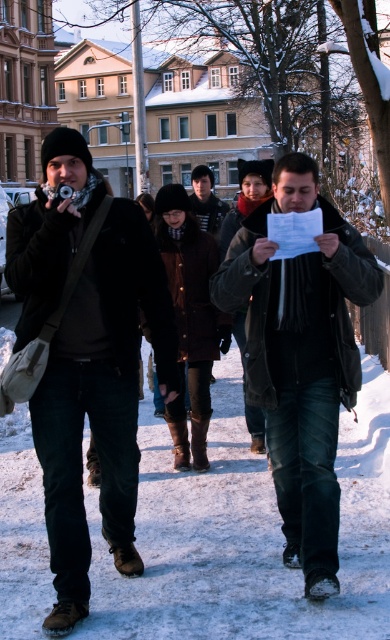
Between point (141, 554) and point (90, 371), which one is positioned in front?

Positioned in front is point (90, 371).

Which is above, white snow at lower center or matte black jacket at left?

matte black jacket at left is higher up.

Is point (195, 589) in front of point (127, 531)?

Yes, point (195, 589) is in front of point (127, 531).

You are a GUI agent. You are given a task and a screenshot of the screen. Output one action in this format:
    pyautogui.click(x=<x>, y=<y>)
    Task: Click on the white snow at lower center
    
    Given the screenshot: What is the action you would take?
    pyautogui.click(x=244, y=534)

Does white snow at lower center lie behind dark gray leather jacket at center?

Yes, it is.

Is white snow at lower center thinner than dark gray leather jacket at center?

Indeed, white snow at lower center has a lesser width compared to dark gray leather jacket at center.

In order to click on white snow at lower center in this screenshot , I will do `click(244, 534)`.

Does matte black jacket at left have a larger size compared to dark gray leather jacket at center?

No.

Is matte black jacket at left taller than dark gray leather jacket at center?

Indeed, matte black jacket at left has a greater height compared to dark gray leather jacket at center.

Is point (131, 472) positioned behind point (228, 301)?

No, it is in front of (228, 301).

This screenshot has height=640, width=390. I want to click on matte black jacket at left, so click(88, 356).